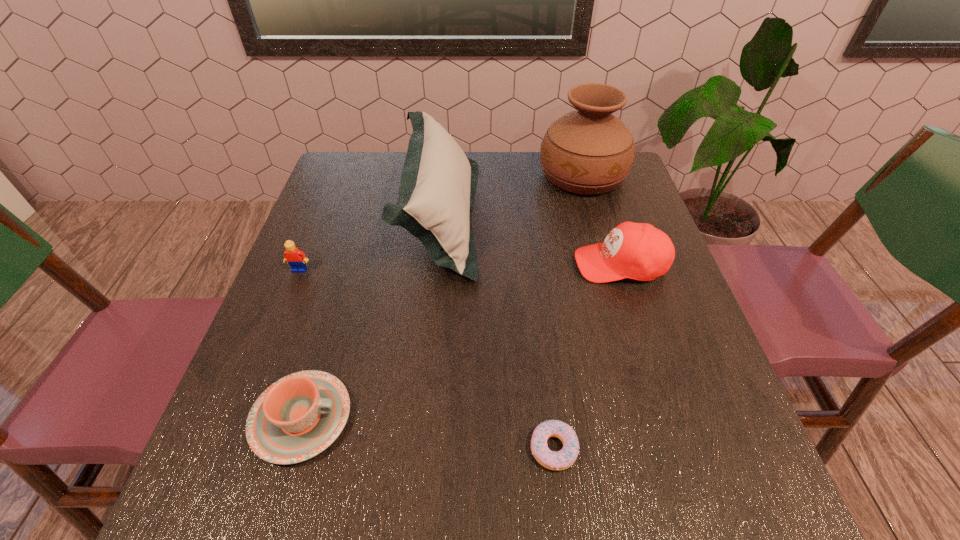
Identify which object is located as the third nearest to the third object from right to left. Please provide its 2D coordinates. Your answer should be formatted as a tuple, i.e. [(x, y)], where the tuple contains the x and y coordinates of a point satisfying the conditions above.

[(438, 183)]

Where is `vacant area that satisfies the following two spatial constraints: 1. on the face of the third object from right to left; 2. on the left side of the third shortest object`? The height and width of the screenshot is (540, 960). vacant area that satisfies the following two spatial constraints: 1. on the face of the third object from right to left; 2. on the left side of the third shortest object is located at coordinates (228, 449).

Locate an element on the screen. The width and height of the screenshot is (960, 540). free location that satisfies the following two spatial constraints: 1. on the surface of the cushion; 2. on the back side of the third object from right to left is located at coordinates (419, 449).

What are the coordinates of `vacant area in the image that satisfies the following two spatial constraints: 1. on the front panel of the baseball cap; 2. on the face of the third shortest object` in the screenshot? It's located at (622, 270).